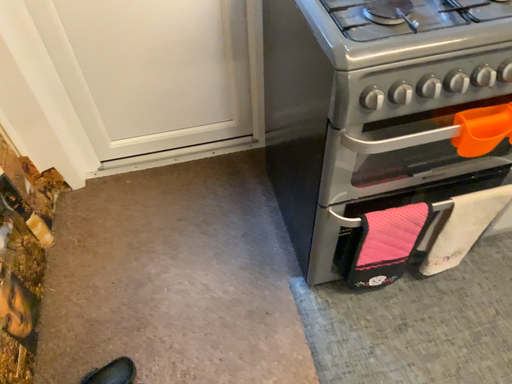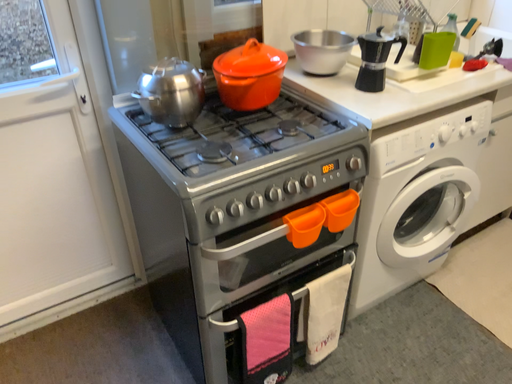
Question: How did the camera likely rotate when shooting the video?

Choices:
 (A) rotated downward
 (B) rotated upward

Answer: (B)